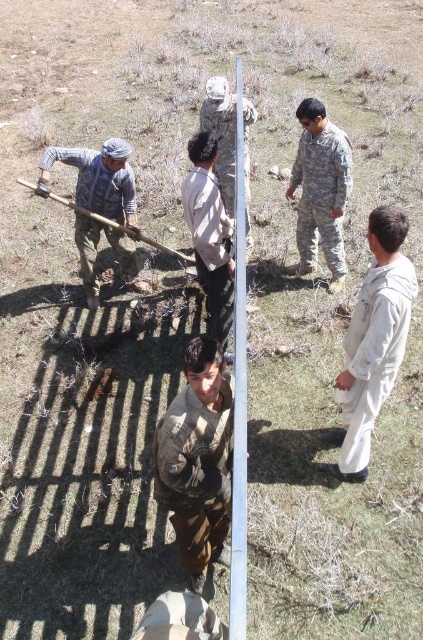
Question: Is camouflage fabric shirt at center smaller than wooden shovel at left?

Choices:
 (A) yes
 (B) no

Answer: (A)

Question: Among these points, which one is farthest from the camera?

Choices:
 (A) (205, 177)
 (B) (370, 378)

Answer: (A)

Question: Considering the relative positions of silver metallic pole at center and camouflage fabric soldier at center in the image provided, where is silver metallic pole at center located with respect to camouflage fabric soldier at center?

Choices:
 (A) right
 (B) left

Answer: (A)

Question: Can you confirm if silver metallic pole at center is wider than camouflage fabric soldier at center?

Choices:
 (A) yes
 (B) no

Answer: (B)

Question: Which of the following is the farthest from the observer?

Choices:
 (A) matte gray fabric at left
 (B) silver metallic pole at center
 (C) white matte uniform at right

Answer: (A)

Question: Among these points, which one is nearest to the camera?

Choices:
 (A) (115, 205)
 (B) (379, 342)

Answer: (B)